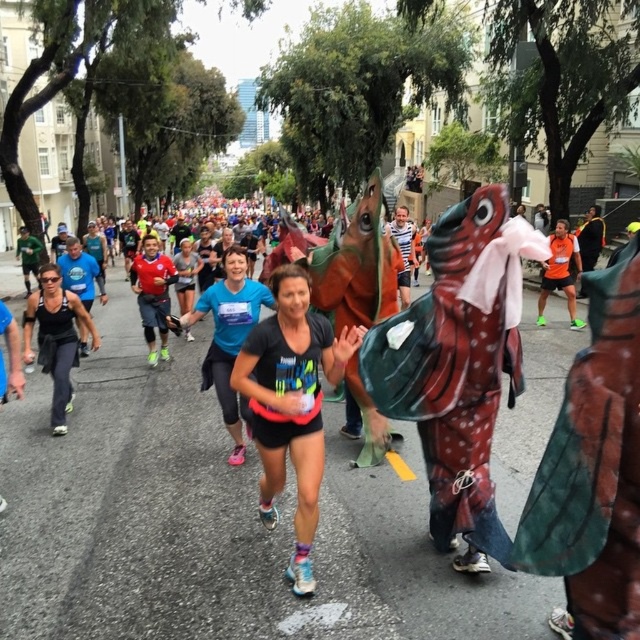
Question: Which object is closer to the camera taking this photo?

Choices:
 (A) black matte t-shirt at center
 (B) blue fabric shirt at center
 (C) matte black tank top at left

Answer: (A)

Question: In this image, where is black matte t-shirt at center located relative to matte black tank top at left?

Choices:
 (A) below
 (B) above

Answer: (A)

Question: Among these points, which one is farthest from the camera?

Choices:
 (A) (294, 419)
 (B) (49, 300)
 (C) (221, 294)

Answer: (B)

Question: Estimate the real-world distances between objects in this image. Which object is farther from the black matte t-shirt at center?

Choices:
 (A) blue fabric shirt at center
 (B) matte black tank top at left

Answer: (B)

Question: Can you confirm if blue fabric shirt at center is thinner than matte black tank top at left?

Choices:
 (A) yes
 (B) no

Answer: (B)

Question: Does blue fabric shirt at center lie behind matte black tank top at left?

Choices:
 (A) yes
 (B) no

Answer: (B)